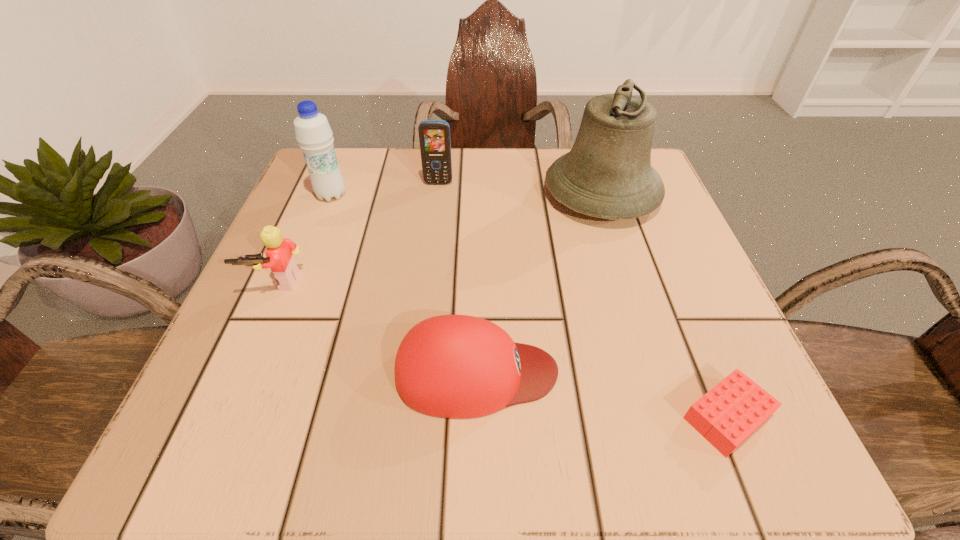
Where is `vacant space at the far left corner of the desktop`? The height and width of the screenshot is (540, 960). vacant space at the far left corner of the desktop is located at coordinates (354, 150).

Image resolution: width=960 pixels, height=540 pixels. What are the coordinates of `free space at the near right corner` in the screenshot? It's located at (682, 402).

This screenshot has width=960, height=540. I want to click on free space between the fourth shortest object and the water bottle, so click(x=385, y=189).

At what (x,y) coordinates should I click in order to perform the action: click on vacant area that lies between the water bottle and the fourth shortest object. Please return your answer as a coordinate pair (x, y). The image size is (960, 540). Looking at the image, I should click on click(385, 189).

What are the coordinates of `free space between the shorter Lego and the cellular telephone` in the screenshot? It's located at (583, 300).

The height and width of the screenshot is (540, 960). I want to click on free area in between the bell and the cellular telephone, so click(x=519, y=189).

This screenshot has width=960, height=540. In order to click on free spot between the left Lego and the second shortest object in this screenshot , I will do `click(377, 327)`.

Where is `vacant area that lies between the baseball cap and the water bottle`? The width and height of the screenshot is (960, 540). vacant area that lies between the baseball cap and the water bottle is located at coordinates (404, 284).

At what (x,y) coordinates should I click in order to perform the action: click on vacant space that's between the water bottle and the fourth shortest object. Please return your answer as a coordinate pair (x, y). The height and width of the screenshot is (540, 960). Looking at the image, I should click on (385, 189).

You are a GUI agent. You are given a task and a screenshot of the screen. Output one action in this format:
    pyautogui.click(x=<x>, y=<y>)
    Task: Click on the free space between the cellular telephone and the baseball cap
    The image size is (960, 540).
    Given the screenshot: What is the action you would take?
    pyautogui.click(x=457, y=278)